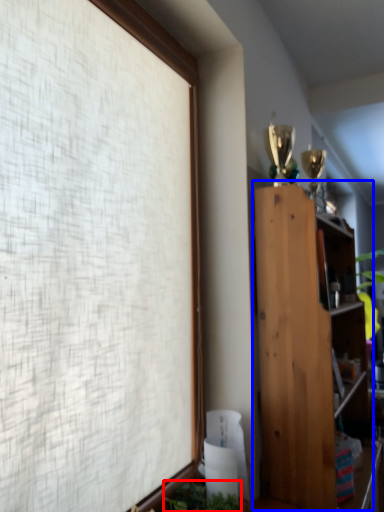
Question: Which point is further to the camera, plant (highlighted by a red box) or bookcase (highlighted by a blue box)?

Choices:
 (A) plant
 (B) bookcase

Answer: (B)